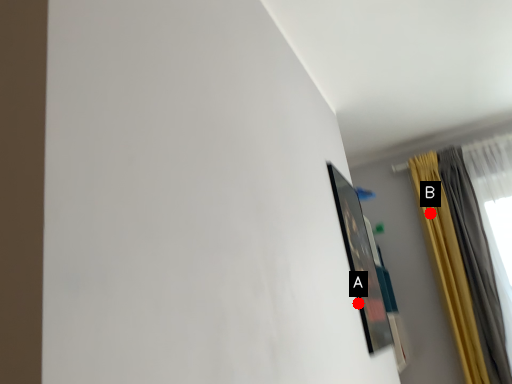
Question: Two points are circled on the image, labeled by A and B beside each circle. Which point appears closest to the camera in this image?

Choices:
 (A) A is closer
 (B) B is closer

Answer: (A)